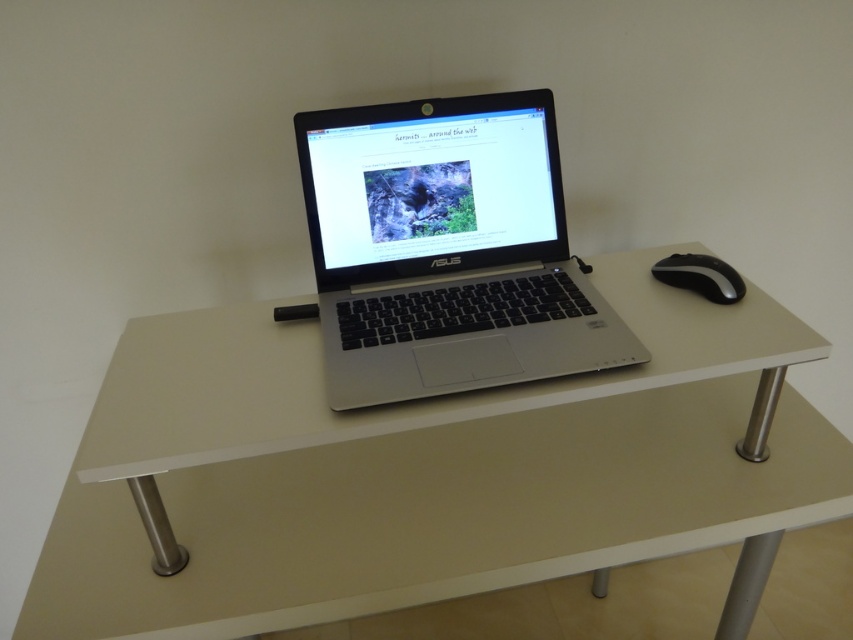
Is point (550, 276) positioned after point (709, 268)?

Yes, it is.

Can you confirm if silver metallic laptop at center is positioned to the right of black rubberized mouse at right?

Incorrect, silver metallic laptop at center is not on the right side of black rubberized mouse at right.

Find the location of a particular element. The width and height of the screenshot is (853, 640). silver metallic laptop at center is located at coordinates (445, 250).

Which is more to the left, white glossy table at center or silver metallic laptop at center?

silver metallic laptop at center

Describe the element at coordinates (422, 468) in the screenshot. I see `white glossy table at center` at that location.

Image resolution: width=853 pixels, height=640 pixels. In order to click on white glossy table at center in this screenshot , I will do `click(422, 468)`.

Which is above, white glossy table at center or black rubberized mouse at right?

black rubberized mouse at right is higher up.

Is white glossy table at center behind black rubberized mouse at right?

No, white glossy table at center is in front of black rubberized mouse at right.

At what (x,y) coordinates should I click in order to perform the action: click on white glossy table at center. Please return your answer as a coordinate pair (x, y). Looking at the image, I should click on (422, 468).